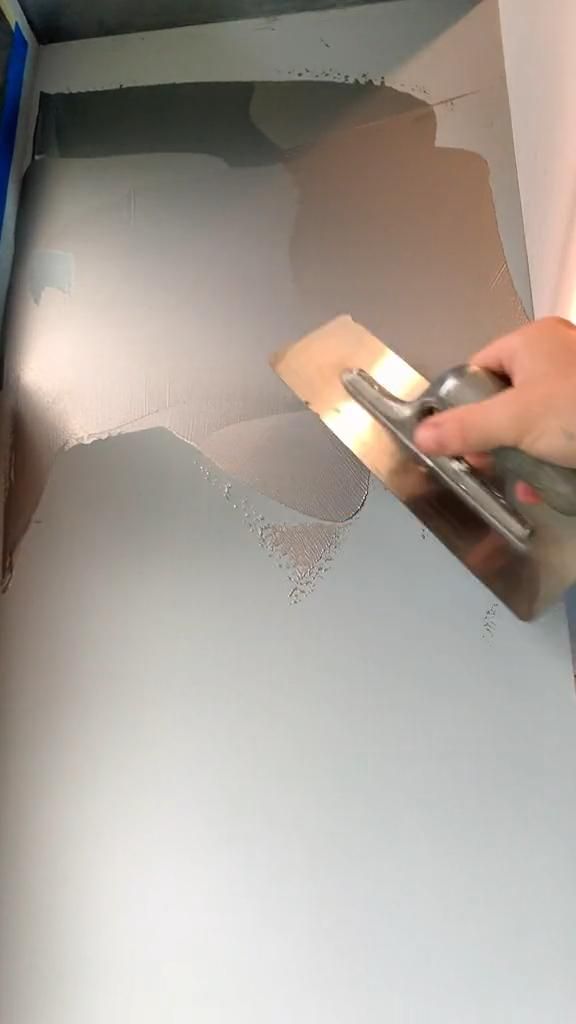
Identify the location of reflective surface. The image size is (576, 1024). (413, 484).